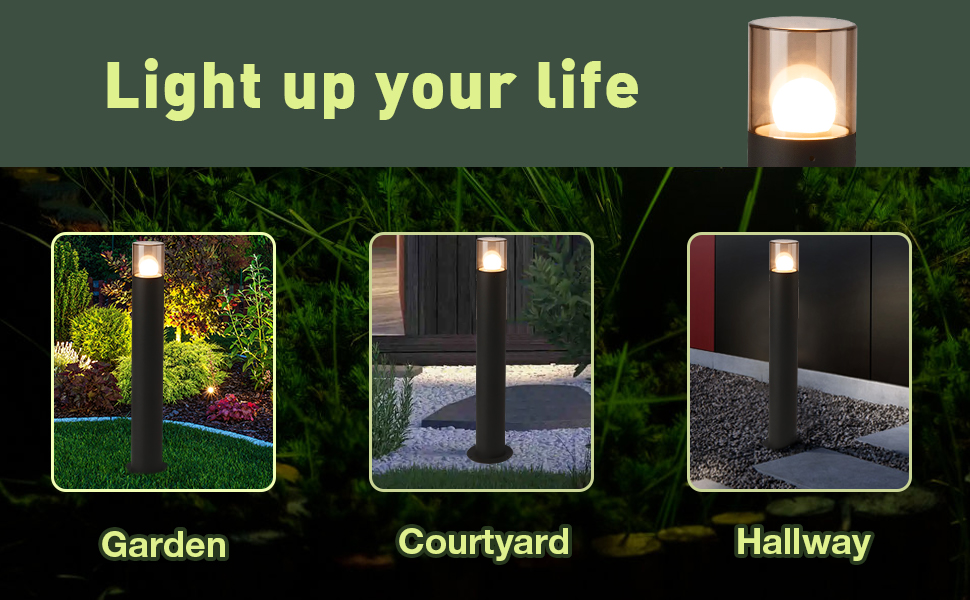
Where is `light bulb`? This screenshot has height=600, width=970. light bulb is located at coordinates coord(810,104).